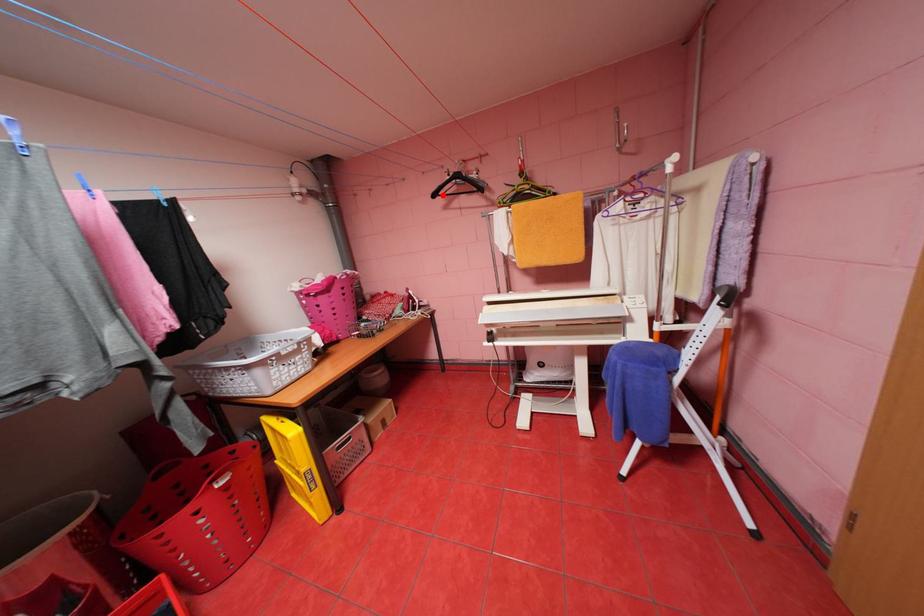
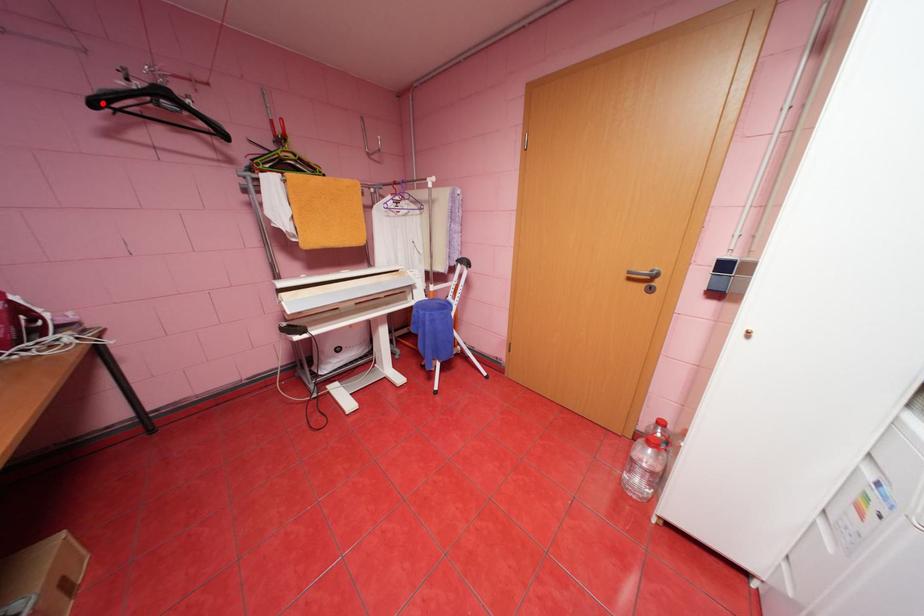
I am providing you with two images of the same scene from different viewpoints. A red point is marked on the first image and another point is marked on the second image. Do the highlighted points in image1 and image2 indicate the same real-world spot?

Yes